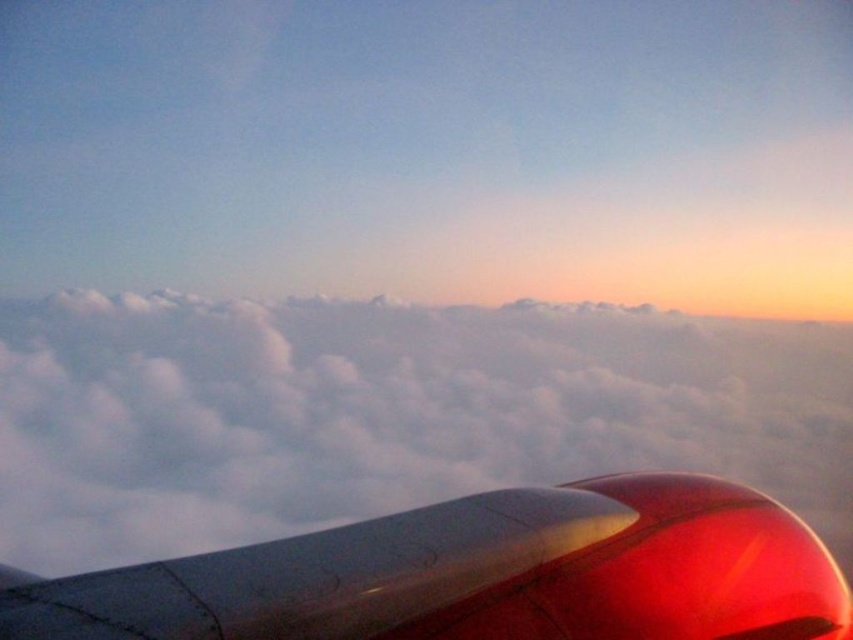
Between point (805, 512) and point (490, 547), which one is positioned behind?

Point (805, 512)

Based on the photo, is white fluffy cloud at center shorter than glossy metallic engine at lower right?

In fact, white fluffy cloud at center may be taller than glossy metallic engine at lower right.

Is point (759, 340) closer to camera compared to point (352, 582)?

No, (759, 340) is behind (352, 582).

This screenshot has width=853, height=640. Find the location of `white fluffy cloud at center`. white fluffy cloud at center is located at coordinates (386, 413).